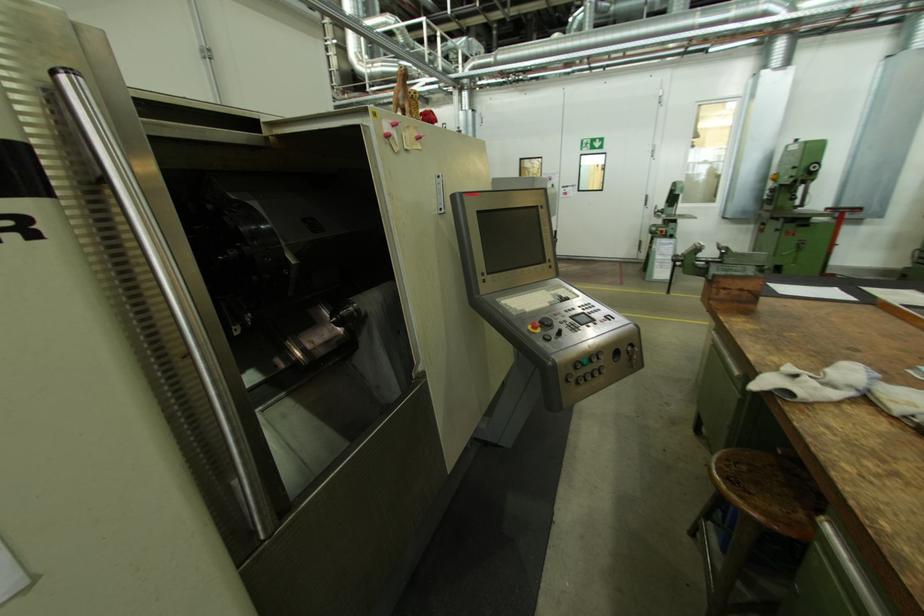
Describe the element at coordinates (598, 363) in the screenshot. Image resolution: width=924 pixels, height=616 pixels. I see `the black control dial` at that location.